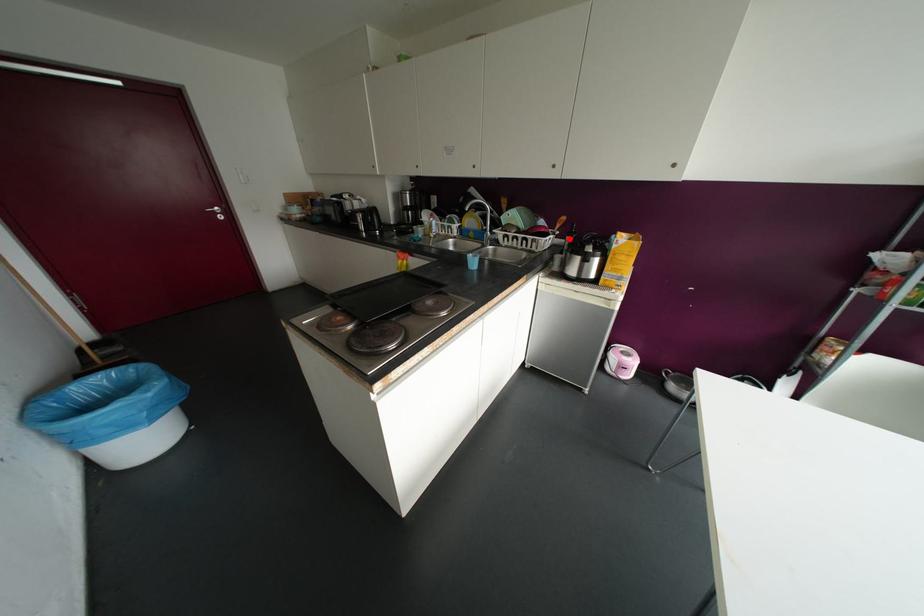
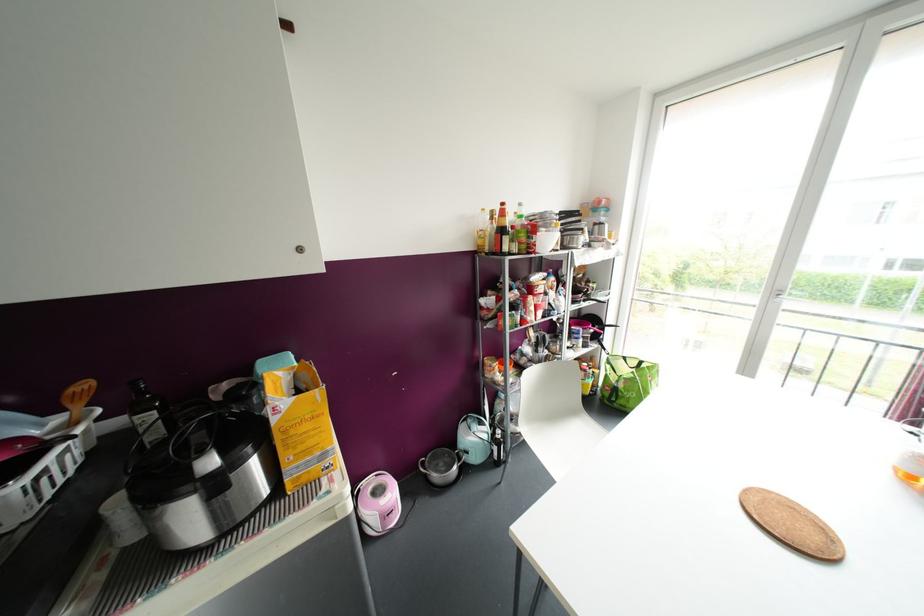
Question: A red point is marked in image1. In image2, is the corresponding 3D point closer to the camera or farther? Reply with the corresponding letter.

Choices:
 (A) The corresponding 3D point is closer.
 (B) The corresponding 3D point is farther.

Answer: (B)